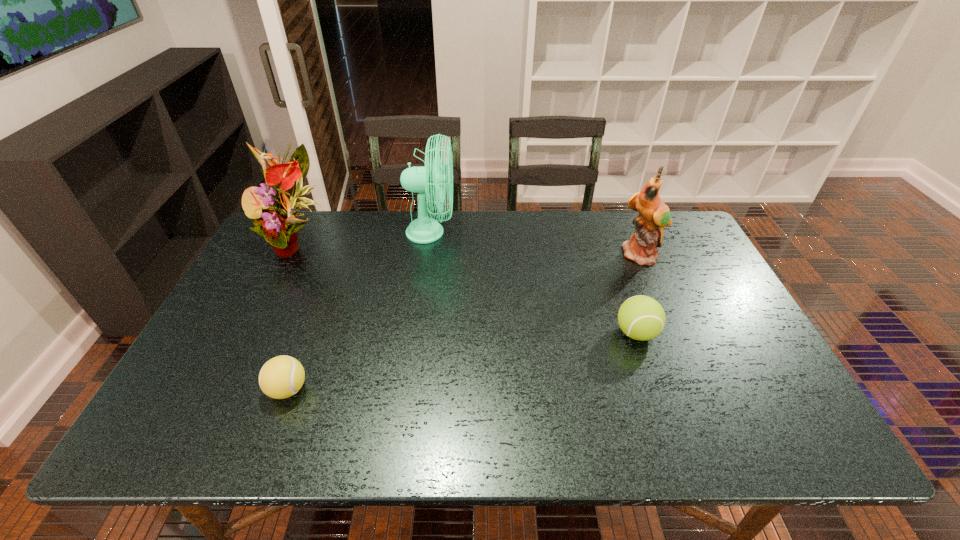
The height and width of the screenshot is (540, 960). In order to click on fan in this screenshot , I will do `click(423, 230)`.

Where is `bouquet`? Image resolution: width=960 pixels, height=540 pixels. bouquet is located at coordinates (277, 224).

The width and height of the screenshot is (960, 540). What are the coordinates of `parrot` in the screenshot? It's located at (654, 214).

Identify the location of the second nearest object. This screenshot has width=960, height=540. (642, 318).

Find the location of a particular element. Image resolution: width=960 pixels, height=540 pixels. the taller tennis ball is located at coordinates (642, 318).

Where is `the shorter tennis ball`? The image size is (960, 540). the shorter tennis ball is located at coordinates (281, 377).

Image resolution: width=960 pixels, height=540 pixels. In order to click on the nearer tennis ball in this screenshot , I will do `click(281, 377)`.

Identify the location of vacant space located in front of the fan to blow air. This screenshot has height=540, width=960. coord(476,233).

Where is `vacant space located 0.270m on the front-facing side of the bouquet`? This screenshot has width=960, height=540. vacant space located 0.270m on the front-facing side of the bouquet is located at coordinates (251, 342).

This screenshot has height=540, width=960. I want to click on blank space located 0.080m on the front-facing side of the parrot, so click(656, 286).